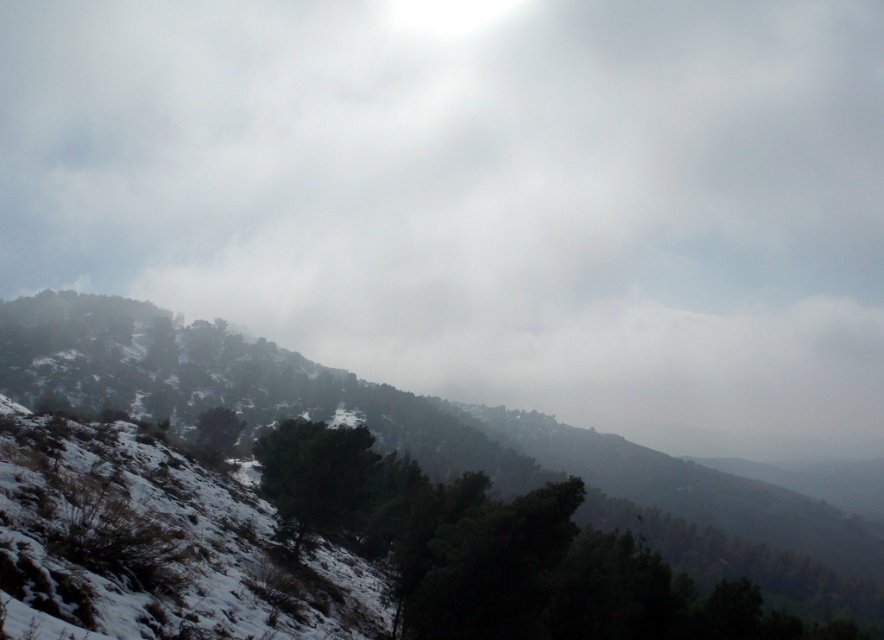
Describe the element at coordinates (481, 196) in the screenshot. Image resolution: width=884 pixels, height=640 pixels. I see `white fluffy cloud at upper center` at that location.

Does white fluffy cloud at upper center have a lesser width compared to snowy forested hillside at upper left?

No.

Which is behind, point (341, 289) or point (184, 385)?

Positioned behind is point (341, 289).

At what (x,y) coordinates should I click in order to perform the action: click on white fluffy cloud at upper center. Please return your answer as a coordinate pair (x, y). Looking at the image, I should click on (481, 196).